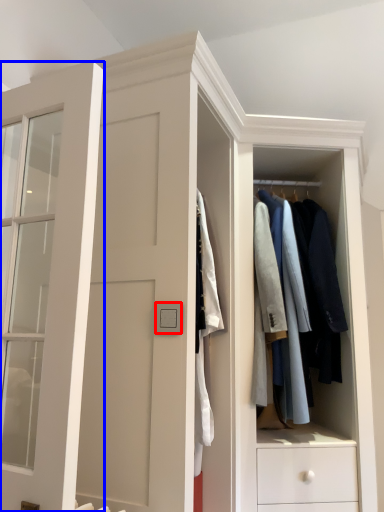
Question: Which object is closer to the camera taking this photo, light switch (highlighted by a red box) or door (highlighted by a blue box)?

Choices:
 (A) light switch
 (B) door

Answer: (B)